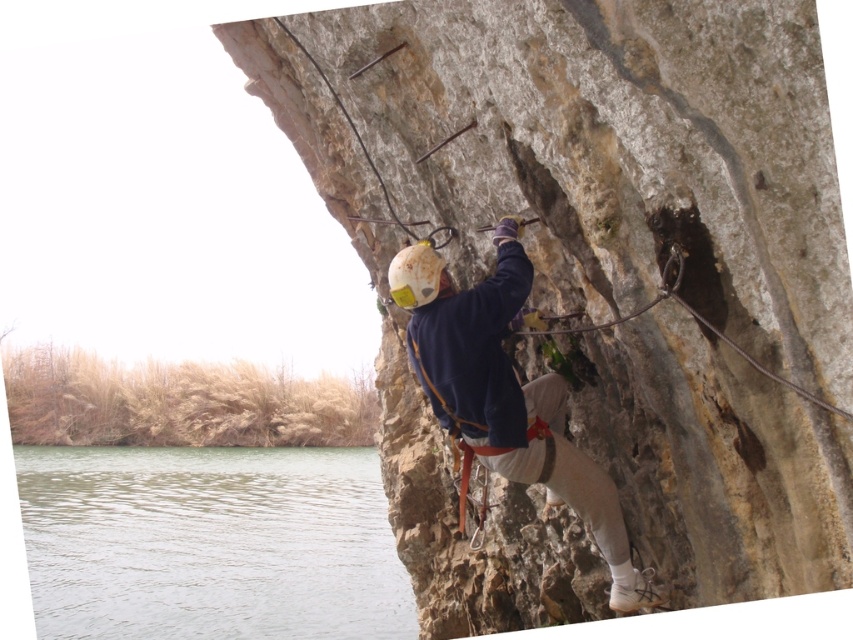
Between dark blue fleece jacket at center and white matte helmet at center, which one appears on the right side from the viewer's perspective?

From the viewer's perspective, dark blue fleece jacket at center appears more on the right side.

Which is below, dark blue fleece jacket at center or white matte helmet at center?

dark blue fleece jacket at center is lower down.

Is point (556, 392) farther from camera compared to point (421, 250)?

Yes, point (556, 392) is behind point (421, 250).

The image size is (853, 640). Find the location of `dark blue fleece jacket at center`. dark blue fleece jacket at center is located at coordinates (514, 406).

Between natural stone rock climber at center and greenish water at lower left, which one has less height?

With less height is greenish water at lower left.

Is point (618, 131) more distant than point (57, 470)?

No.

Locate an element on the screen. natural stone rock climber at center is located at coordinates (589, 224).

Which is more to the left, natural stone rock climber at center or white matte helmet at center?

Positioned to the left is natural stone rock climber at center.

Can you confirm if natural stone rock climber at center is bigger than white matte helmet at center?

Yes, natural stone rock climber at center is bigger than white matte helmet at center.

Is point (642, 499) more distant than point (433, 292)?

Yes, point (642, 499) is farther from viewer.

Where is `natural stone rock climber at center`? Image resolution: width=853 pixels, height=640 pixels. natural stone rock climber at center is located at coordinates (589, 224).